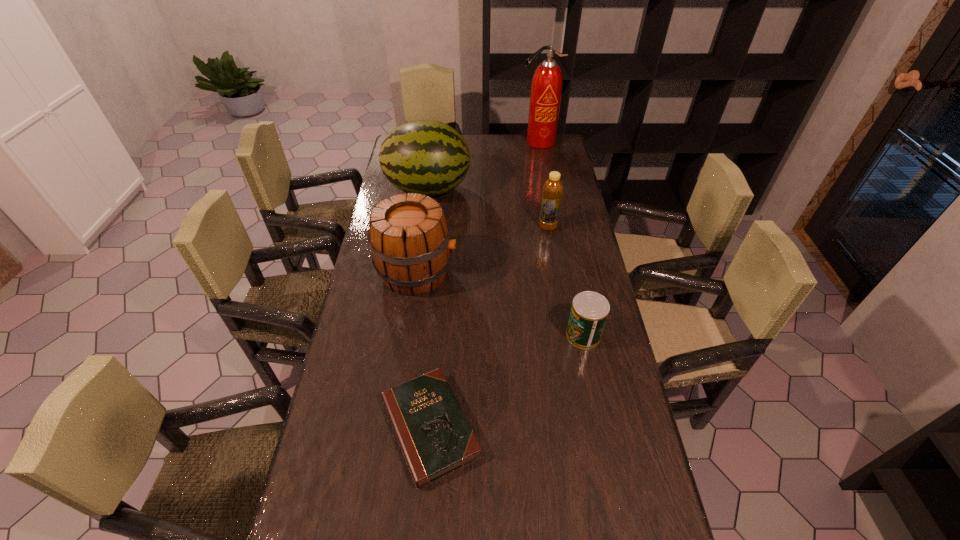
The width and height of the screenshot is (960, 540). I want to click on vacant space that satisfies the following two spatial constraints: 1. on the front side of the second nearest object; 2. on the right side of the third farthest object, so click(565, 335).

Where is `free spot that satisfies the following two spatial constraints: 1. at the stem end of the watermelon; 2. on the back side of the bottle`? free spot that satisfies the following two spatial constraints: 1. at the stem end of the watermelon; 2. on the back side of the bottle is located at coordinates (422, 227).

This screenshot has height=540, width=960. Identify the location of vacant space that satisfies the following two spatial constraints: 1. on the back side of the fifth farthest object; 2. on the side of the cider where the spigot is located. (570, 272).